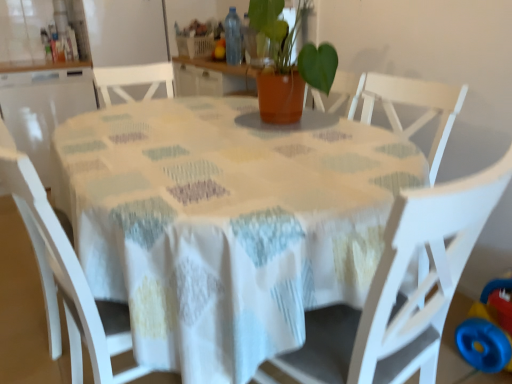
Question: Is white fabric table at center to the right of blue plastic toy at lower right from the viewer's perspective?

Choices:
 (A) yes
 (B) no

Answer: (B)

Question: Does white fabric table at center have a smaller size compared to blue plastic toy at lower right?

Choices:
 (A) no
 (B) yes

Answer: (A)

Question: Does white fabric table at center come in front of blue plastic toy at lower right?

Choices:
 (A) no
 (B) yes

Answer: (B)

Question: Can you confirm if white fabric table at center is thinner than blue plastic toy at lower right?

Choices:
 (A) yes
 (B) no

Answer: (B)

Question: Considering the relative sizes of white fabric table at center and blue plastic toy at lower right in the image provided, is white fabric table at center taller than blue plastic toy at lower right?

Choices:
 (A) yes
 (B) no

Answer: (A)

Question: Based on their sizes in the image, would you say white fabric table at center is bigger or smaller than white matte chair at left, the second chair viewed from the right?

Choices:
 (A) big
 (B) small

Answer: (A)

Question: Is white fabric table at center in front of or behind white matte chair at left, acting as the first chair starting from the left, in the image?

Choices:
 (A) front
 (B) behind

Answer: (A)

Question: In terms of width, does white fabric table at center look wider or thinner when compared to white matte chair at left, acting as the first chair starting from the left?

Choices:
 (A) wide
 (B) thin

Answer: (A)

Question: From a real-world perspective, relative to white matte chair at left, acting as the first chair starting from the left, is white fabric table at center vertically above or below?

Choices:
 (A) below
 (B) above

Answer: (A)

Question: Does point (232, 56) appear closer or farther from the camera than point (252, 6)?

Choices:
 (A) closer
 (B) farther

Answer: (B)

Question: Considering their positions, is transparent plastic bottle at center located in front of or behind terracotta pot at center?

Choices:
 (A) behind
 (B) front

Answer: (A)

Question: Looking at their shapes, would you say transparent plastic bottle at center is wider or thinner than terracotta pot at center?

Choices:
 (A) thin
 (B) wide

Answer: (A)

Question: From the image's perspective, is transparent plastic bottle at center positioned above or below terracotta pot at center?

Choices:
 (A) above
 (B) below

Answer: (A)

Question: Considering the positions of point (234, 24) and point (116, 347), is point (234, 24) closer or farther from the camera than point (116, 347)?

Choices:
 (A) farther
 (B) closer

Answer: (A)

Question: In the image, is transparent plastic bottle at center positioned in front of or behind white matte chair at left, the second chair viewed from the right?

Choices:
 (A) front
 (B) behind

Answer: (B)